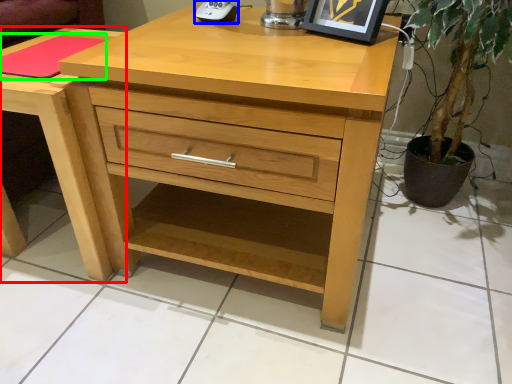
Question: Which object is the farthest from nightstand (highlighted by a red box)? Choose among these: gadget (highlighted by a blue box) or pad (highlighted by a green box).

Choices:
 (A) gadget
 (B) pad

Answer: (A)